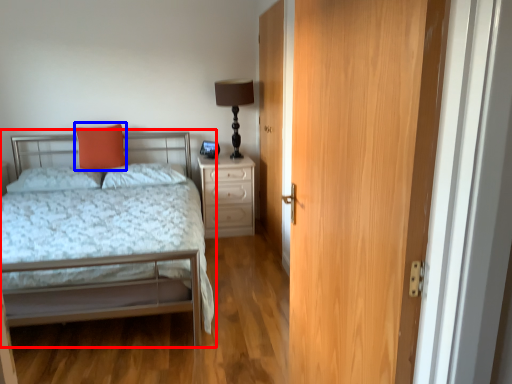
Question: Which of the following is the farthest to the observer, bed (highlighted by a red box) or throw pillow (highlighted by a blue box)?

Choices:
 (A) bed
 (B) throw pillow

Answer: (B)